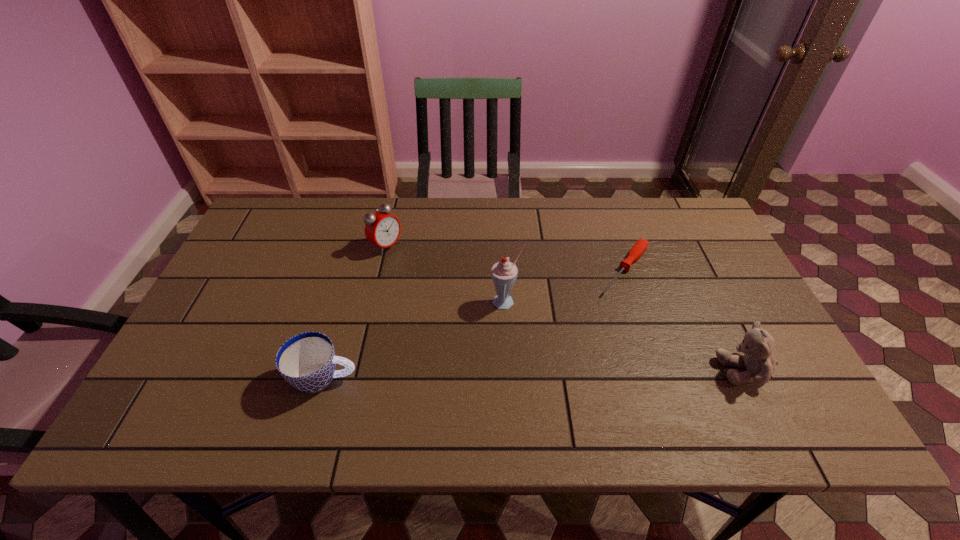
Image resolution: width=960 pixels, height=540 pixels. In the image, there is a desktop. Find the location of `free space at the far right corner`. free space at the far right corner is located at coordinates (694, 207).

The image size is (960, 540). I want to click on empty space between the third object from left to right and the rightmost object, so click(x=626, y=336).

Locate an element on the screen. This screenshot has width=960, height=540. vacant area between the shortest object and the teddy bear is located at coordinates (685, 320).

The width and height of the screenshot is (960, 540). I want to click on free space between the rightmost object and the alarm clock, so click(x=566, y=308).

This screenshot has width=960, height=540. In order to click on vacant area between the shortest object and the rightmost object in this screenshot , I will do `click(685, 320)`.

Locate an element on the screen. unoccupied area between the cup and the rightmost object is located at coordinates (535, 374).

The height and width of the screenshot is (540, 960). I want to click on free space that is in between the cup and the milkshake, so (x=416, y=340).

Where is `vacant area that lies between the cup and the alarm clock`? The image size is (960, 540). vacant area that lies between the cup and the alarm clock is located at coordinates (355, 312).

Identify the location of empty space between the teddy bear and the shortest object. The image size is (960, 540). (x=685, y=320).

Locate an element on the screen. free space that is in between the tallest object and the alarm clock is located at coordinates (446, 274).